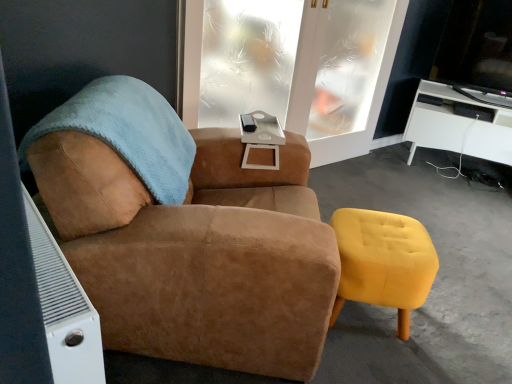
Question: Should I look upward or downward to see white glossy desk at right?

Choices:
 (A) down
 (B) up

Answer: (B)

Question: From the image's perspective, does yellow velvet stool at lower right appear higher than white glossy desk at right?

Choices:
 (A) no
 (B) yes

Answer: (A)

Question: From a real-world perspective, is yellow velvet stool at lower right located beneath white glossy desk at right?

Choices:
 (A) yes
 (B) no

Answer: (A)

Question: Is yellow velvet stool at lower right further to camera compared to white glossy desk at right?

Choices:
 (A) no
 (B) yes

Answer: (A)

Question: Is yellow velvet stool at lower right smaller than white glossy desk at right?

Choices:
 (A) yes
 (B) no

Answer: (A)

Question: Is yellow velvet stool at lower right turned away from white glossy desk at right?

Choices:
 (A) no
 (B) yes

Answer: (A)

Question: Is yellow velvet stool at lower right oriented towards white glossy desk at right?

Choices:
 (A) yes
 (B) no

Answer: (B)

Question: Can you confirm if clear frosted glass door at upper center is wider than white glossy desk at right?

Choices:
 (A) no
 (B) yes

Answer: (A)

Question: Is clear frosted glass door at upper center beside white glossy desk at right?

Choices:
 (A) yes
 (B) no

Answer: (B)

Question: Is clear frosted glass door at upper center to the left of white glossy desk at right from the viewer's perspective?

Choices:
 (A) no
 (B) yes

Answer: (B)

Question: Is clear frosted glass door at upper center at the right side of white glossy desk at right?

Choices:
 (A) yes
 (B) no

Answer: (B)

Question: From a real-world perspective, is clear frosted glass door at upper center positioned under white glossy desk at right based on gravity?

Choices:
 (A) no
 (B) yes

Answer: (A)

Question: Is clear frosted glass door at upper center turned away from white glossy desk at right?

Choices:
 (A) no
 (B) yes

Answer: (A)

Question: Does white glossy desk at right have a lesser width compared to suede brown armchair at center?

Choices:
 (A) no
 (B) yes

Answer: (B)